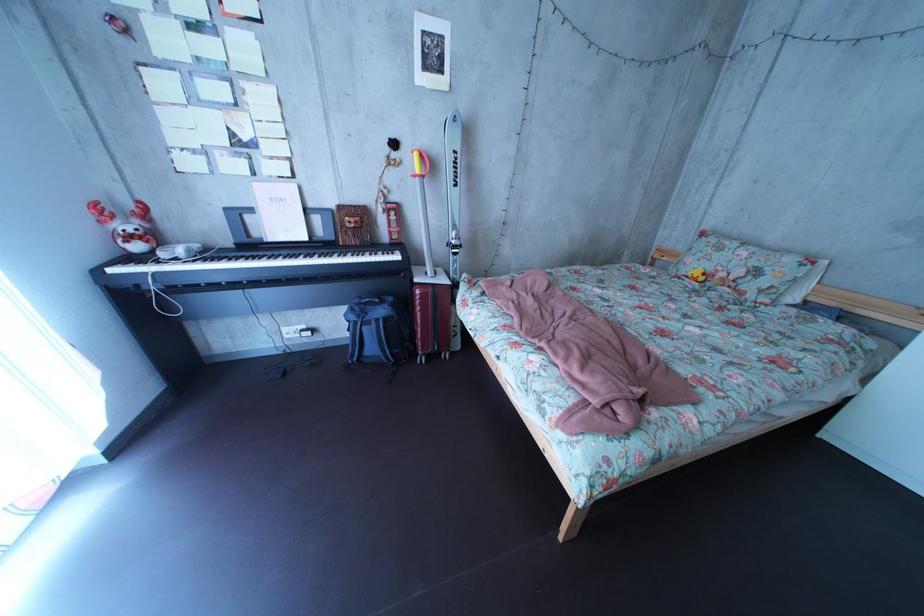
This screenshot has width=924, height=616. Find the location of `piano keys`. piano keys is located at coordinates click(x=306, y=259).